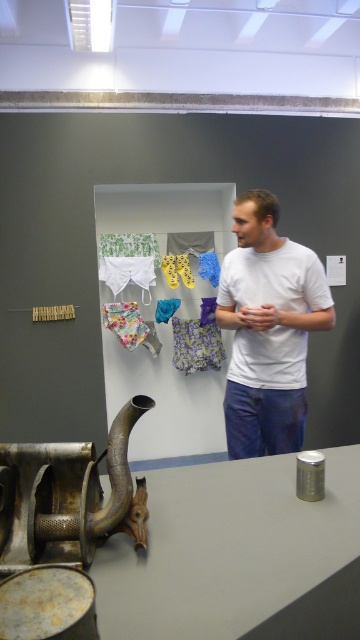
Question: Is white matte t-shirt at center below floral fabric underwear at center?

Choices:
 (A) yes
 (B) no

Answer: (B)

Question: Estimate the real-world distances between objects in this image. Which object is closer to the rusty metal sculpture at lower left?

Choices:
 (A) floral fabric underwear at center
 (B) white matte t-shirt at center

Answer: (B)

Question: Which of the following is the farthest from the observer?

Choices:
 (A) (182, 346)
 (B) (24, 531)
 (C) (236, 348)

Answer: (A)

Question: Observing the image, what is the correct spatial positioning of white matte t-shirt at center in reference to rusty metal sculpture at lower left?

Choices:
 (A) right
 (B) left

Answer: (A)

Question: Is rusty metal sculpture at lower left above floral fabric underwear at center?

Choices:
 (A) yes
 (B) no

Answer: (B)

Question: Which object appears closest to the camera in this image?

Choices:
 (A) rusty metal sculpture at lower left
 (B) white matte t-shirt at center
 (C) floral fabric underwear at center

Answer: (A)